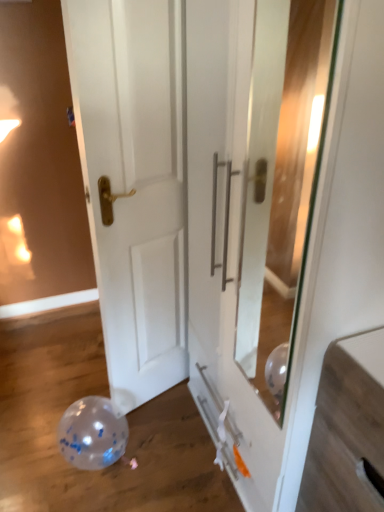
The width and height of the screenshot is (384, 512). Describe the element at coordinates (135, 182) in the screenshot. I see `white glossy door at center` at that location.

Image resolution: width=384 pixels, height=512 pixels. Find the location of `white glossy door at center`. white glossy door at center is located at coordinates (135, 182).

At what (x,y) coordinates should I click in order to perform the action: click on white glossy door at center. Please return your answer as a coordinate pair (x, y). Looking at the image, I should click on (135, 182).